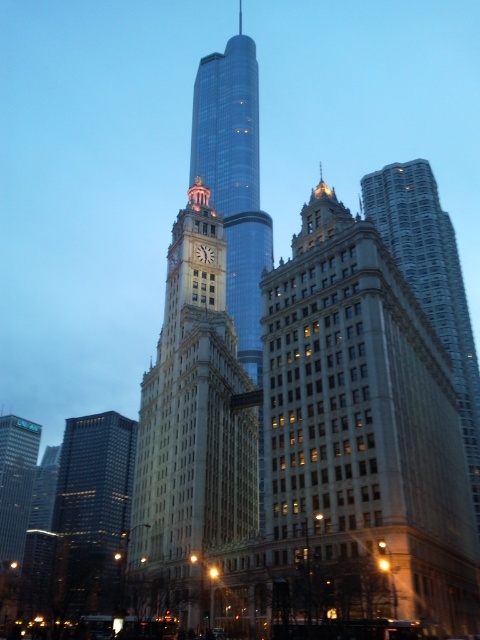
Looking at this image, can you confirm if beige stone building at center is thinner than shiny glass skyscraper at center?

Yes, beige stone building at center is thinner than shiny glass skyscraper at center.

From the picture: Who is more forward, (474, 579) or (222, 172)?

Point (474, 579) is in front.

Where is `beige stone building at center`? The width and height of the screenshot is (480, 640). beige stone building at center is located at coordinates (363, 426).

Is shiny glass skyscraper at center bigger than silver metallic skyscraper at center?

Indeed, shiny glass skyscraper at center has a larger size compared to silver metallic skyscraper at center.

Is shiny glass skyscraper at center taller than silver metallic skyscraper at center?

Correct, shiny glass skyscraper at center is much taller as silver metallic skyscraper at center.

Where is `shiny glass skyscraper at center`? shiny glass skyscraper at center is located at coordinates (235, 180).

Image resolution: width=480 pixels, height=640 pixels. Find the location of `shiny glass skyscraper at center`. shiny glass skyscraper at center is located at coordinates (235, 180).

Does shiny glass skyscraper at center have a larger size compared to dark glass skyscraper at left?

Correct, shiny glass skyscraper at center is larger in size than dark glass skyscraper at left.

Which is more to the left, shiny glass skyscraper at center or dark glass skyscraper at left?

dark glass skyscraper at left

Image resolution: width=480 pixels, height=640 pixels. Describe the element at coordinates (235, 180) in the screenshot. I see `shiny glass skyscraper at center` at that location.

Locate an element on the screen. shiny glass skyscraper at center is located at coordinates (235, 180).